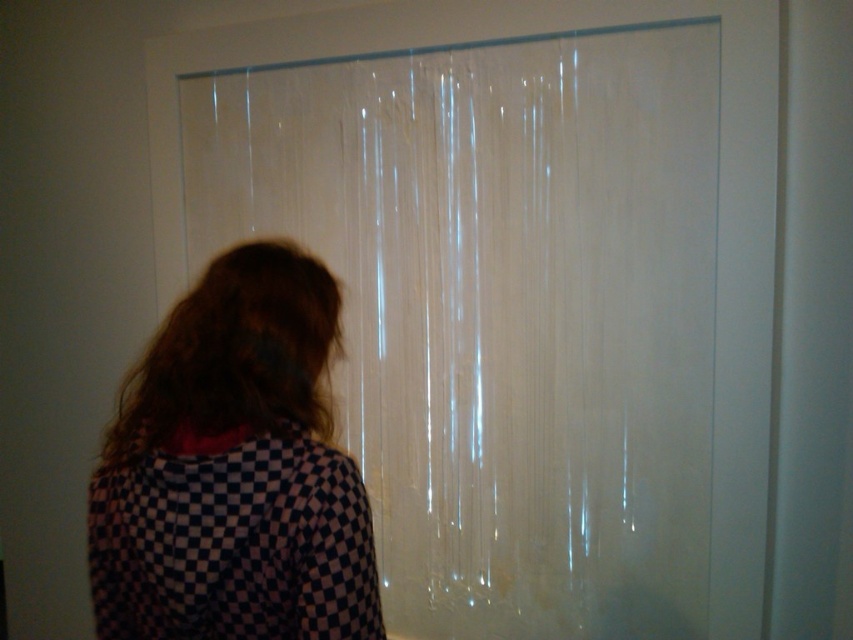
Question: Is checkered fabric at left further to the viewer compared to brownhair at left?

Choices:
 (A) no
 (B) yes

Answer: (A)

Question: Which object appears farthest from the camera in this image?

Choices:
 (A) brownhair at left
 (B) checkered fabric at left
 (C) transparent plastic shower curtain at center

Answer: (C)

Question: Does transparent plastic shower curtain at center appear under brownhair at left?

Choices:
 (A) yes
 (B) no

Answer: (B)

Question: Is transparent plastic shower curtain at center in front of checkered fabric at left?

Choices:
 (A) yes
 (B) no

Answer: (B)

Question: Which point appears closest to the camera in this image?

Choices:
 (A) (248, 467)
 (B) (590, 218)

Answer: (A)

Question: Which object is the farthest from the checkered fabric at left?

Choices:
 (A) brownhair at left
 (B) transparent plastic shower curtain at center

Answer: (B)